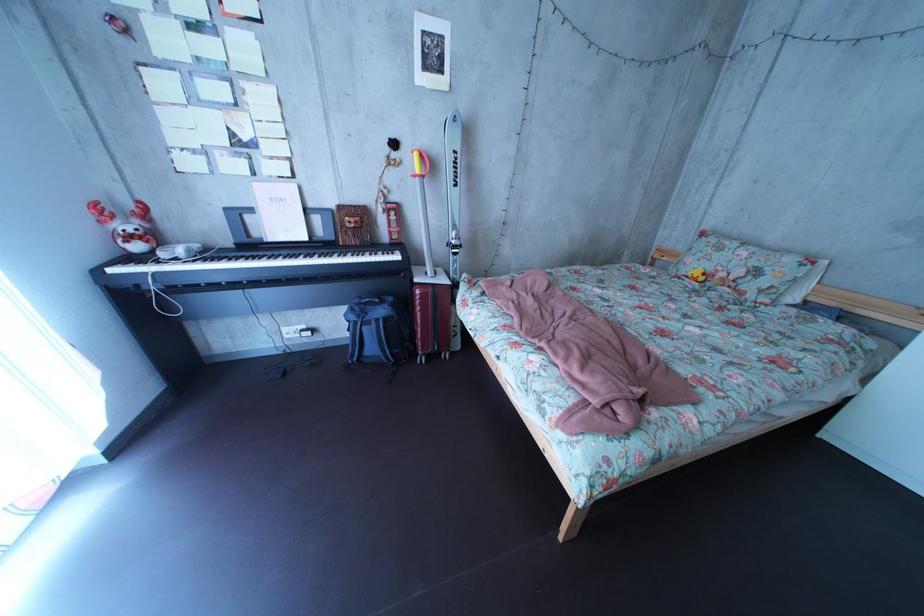
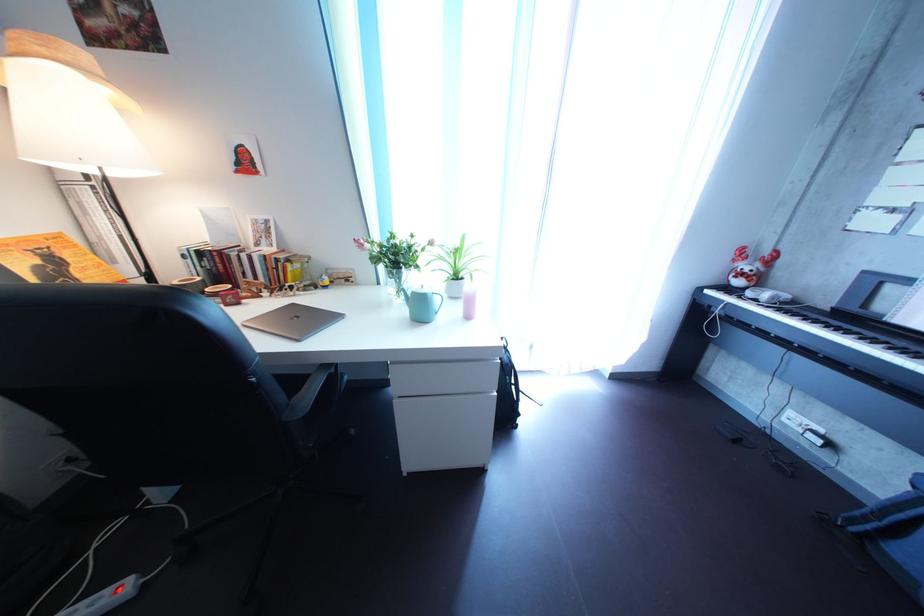
Where in the second image is the point corresponding to point 213,254 from the first image?

(801, 304)